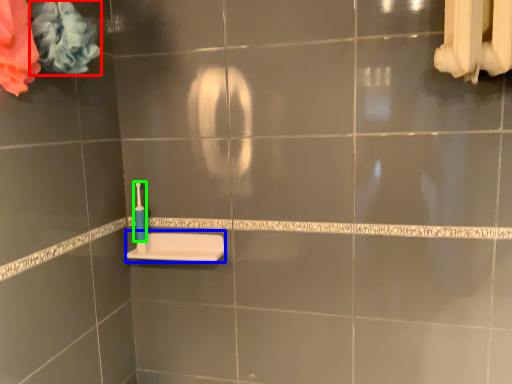
Question: Based on their relative distances, which object is nearer to flower (highlighted by a red box)? Choose from sink (highlighted by a blue box) and toothbrush (highlighted by a green box).

Choices:
 (A) sink
 (B) toothbrush

Answer: (B)